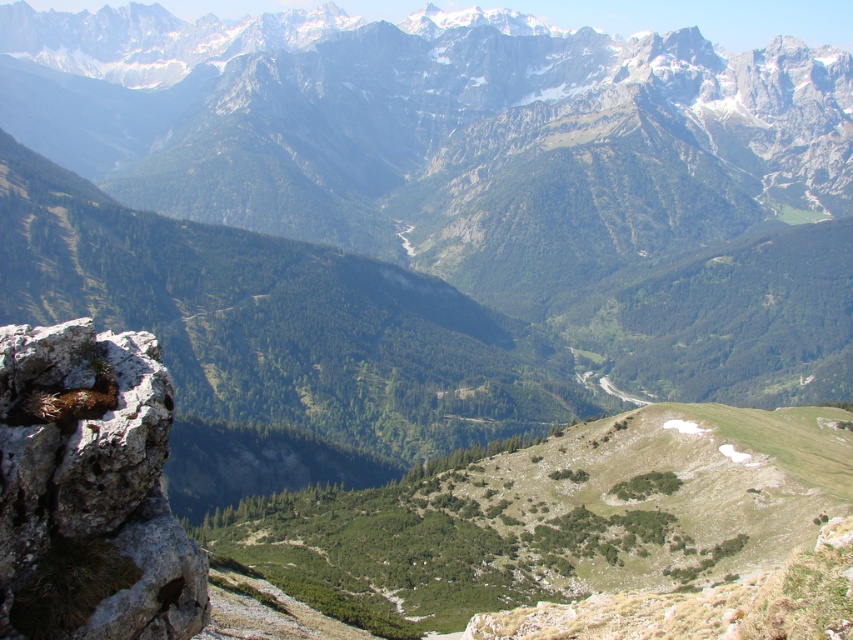
Is point (335, 504) closer to camera compared to point (112, 368)?

That is False.

This screenshot has height=640, width=853. Identify the location of green grassy hillside at center. (570, 528).